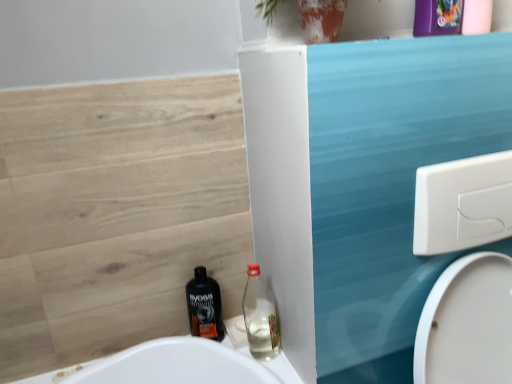
Question: Which direction should I rotate to look at clear glass bottle at lower center, which appears as the first bottle when viewed from the right?

Choices:
 (A) left
 (B) right

Answer: (B)

Question: Does clear glass bottle at lower center, which appears as the first bottle when viewed from the right, lie in front of black plastic bottle at lower center, marked as the second bottle in a right-to-left arrangement?

Choices:
 (A) yes
 (B) no

Answer: (A)

Question: Is clear glass bottle at lower center, which is the second bottle in left-to-right order, surrounding black plastic bottle at lower center, marked as the second bottle in a right-to-left arrangement?

Choices:
 (A) yes
 (B) no

Answer: (B)

Question: Considering the relative positions of clear glass bottle at lower center, which is the second bottle in left-to-right order, and black plastic bottle at lower center, the 1th bottle when ordered from left to right, in the image provided, is clear glass bottle at lower center, which is the second bottle in left-to-right order, to the left of black plastic bottle at lower center, the 1th bottle when ordered from left to right, from the viewer's perspective?

Choices:
 (A) no
 (B) yes

Answer: (A)

Question: Considering the relative sizes of clear glass bottle at lower center, which is the second bottle in left-to-right order, and black plastic bottle at lower center, marked as the second bottle in a right-to-left arrangement, in the image provided, is clear glass bottle at lower center, which is the second bottle in left-to-right order, wider than black plastic bottle at lower center, marked as the second bottle in a right-to-left arrangement,?

Choices:
 (A) no
 (B) yes

Answer: (A)

Question: Is clear glass bottle at lower center, which is the second bottle in left-to-right order, taller than black plastic bottle at lower center, the 1th bottle when ordered from left to right?

Choices:
 (A) yes
 (B) no

Answer: (B)

Question: Is clear glass bottle at lower center, which is the second bottle in left-to-right order, touching black plastic bottle at lower center, marked as the second bottle in a right-to-left arrangement?

Choices:
 (A) yes
 (B) no

Answer: (B)

Question: Would you say clear glass bottle at lower center, which is the second bottle in left-to-right order, is part of black plastic bottle at lower center, marked as the second bottle in a right-to-left arrangement,'s contents?

Choices:
 (A) no
 (B) yes

Answer: (A)

Question: Is black plastic bottle at lower center, the 1th bottle when ordered from left to right, positioned behind clear glass bottle at lower center, which is the second bottle in left-to-right order?

Choices:
 (A) yes
 (B) no

Answer: (A)

Question: Considering the relative positions of black plastic bottle at lower center, the 1th bottle when ordered from left to right, and clear glass bottle at lower center, which is the second bottle in left-to-right order, in the image provided, is black plastic bottle at lower center, the 1th bottle when ordered from left to right, in front of clear glass bottle at lower center, which is the second bottle in left-to-right order,?

Choices:
 (A) no
 (B) yes

Answer: (A)

Question: Does black plastic bottle at lower center, the 1th bottle when ordered from left to right, have a smaller size compared to clear glass bottle at lower center, which appears as the first bottle when viewed from the right?

Choices:
 (A) yes
 (B) no

Answer: (A)

Question: From a real-world perspective, is black plastic bottle at lower center, the 1th bottle when ordered from left to right, beneath clear glass bottle at lower center, which is the second bottle in left-to-right order?

Choices:
 (A) no
 (B) yes

Answer: (B)

Question: Is clear glass bottle at lower center, which appears as the first bottle when viewed from the right, at the back of black plastic bottle at lower center, marked as the second bottle in a right-to-left arrangement?

Choices:
 (A) no
 (B) yes

Answer: (A)

Question: From the image's perspective, is clear glass bottle at lower center, which is the second bottle in left-to-right order, positioned above or below black plastic bottle at lower center, marked as the second bottle in a right-to-left arrangement?

Choices:
 (A) above
 (B) below

Answer: (A)